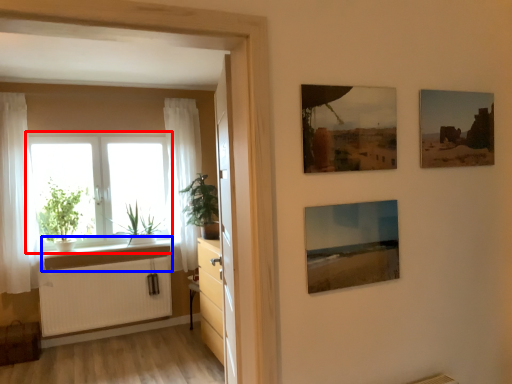
Question: Among these objects, which one is nearest to the camera, window (highlighted by a red box) or window sill (highlighted by a blue box)?

Choices:
 (A) window
 (B) window sill

Answer: (B)